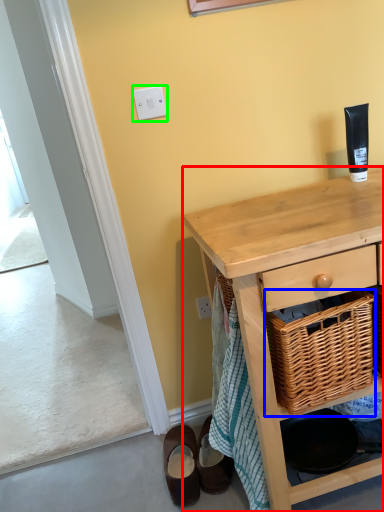
Question: Which object is the farthest from desk (highlighted by a red box)? Choose among these: picnic basket (highlighted by a blue box) or light switch (highlighted by a green box).

Choices:
 (A) picnic basket
 (B) light switch

Answer: (B)